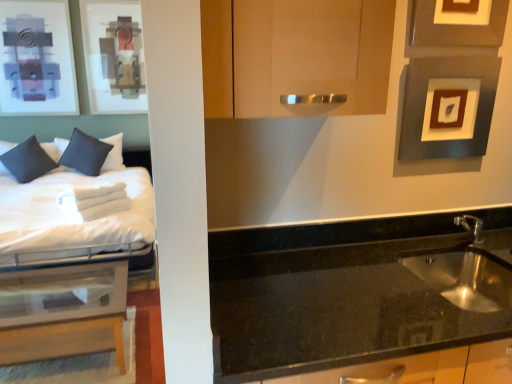
Question: Considering the relative positions of white soft bed at left and dark blue fabric pillow at left, which appears as the first pillow when viewed from the left, in the image provided, is white soft bed at left to the right of dark blue fabric pillow at left, which appears as the first pillow when viewed from the left, from the viewer's perspective?

Choices:
 (A) yes
 (B) no

Answer: (A)

Question: Can you confirm if white soft bed at left is smaller than dark blue fabric pillow at left, which appears as the first pillow when viewed from the left?

Choices:
 (A) no
 (B) yes

Answer: (A)

Question: Is white soft bed at left completely or partially outside of dark blue fabric pillow at left, which appears as the first pillow when viewed from the left?

Choices:
 (A) yes
 (B) no

Answer: (A)

Question: Is white soft bed at left oriented away from dark blue fabric pillow at left, which appears as the second pillow when viewed from the right?

Choices:
 (A) yes
 (B) no

Answer: (B)

Question: Is there a large distance between white soft bed at left and dark blue fabric pillow at left, which appears as the first pillow when viewed from the left?

Choices:
 (A) no
 (B) yes

Answer: (A)

Question: Visually, is translucent glass table at left positioned to the left or to the right of matte gray picture frame at upper right, the first picture frame in the bottom-to-top sequence?

Choices:
 (A) right
 (B) left

Answer: (B)

Question: In terms of height, does translucent glass table at left look taller or shorter compared to matte gray picture frame at upper right, the first picture frame in the bottom-to-top sequence?

Choices:
 (A) tall
 (B) short

Answer: (A)

Question: From the image's perspective, is translucent glass table at left positioned above or below matte gray picture frame at upper right, placed as the second picture frame when sorted from top to bottom?

Choices:
 (A) above
 (B) below

Answer: (B)

Question: Based on their sizes in the image, would you say translucent glass table at left is bigger or smaller than matte gray picture frame at upper right, placed as the second picture frame when sorted from top to bottom?

Choices:
 (A) small
 (B) big

Answer: (B)

Question: Is matte gray picture frame at upper right, placed as the second picture frame when sorted from top to bottom, spatially inside black granite sink at lower right, or outside of it?

Choices:
 (A) outside
 (B) inside

Answer: (A)

Question: In terms of width, does matte gray picture frame at upper right, the first picture frame in the bottom-to-top sequence, look wider or thinner when compared to black granite sink at lower right?

Choices:
 (A) wide
 (B) thin

Answer: (B)

Question: Considering the positions of matte gray picture frame at upper right, the first picture frame in the bottom-to-top sequence, and black granite sink at lower right in the image, is matte gray picture frame at upper right, the first picture frame in the bottom-to-top sequence, bigger or smaller than black granite sink at lower right?

Choices:
 (A) big
 (B) small

Answer: (B)

Question: Is matte gray picture frame at upper right, the first picture frame in the bottom-to-top sequence, in front of or behind black granite sink at lower right in the image?

Choices:
 (A) behind
 (B) front

Answer: (A)

Question: Considering the positions of black granite sink at lower right and matte gray picture frame at upper right, the first picture frame in the bottom-to-top sequence, in the image, is black granite sink at lower right bigger or smaller than matte gray picture frame at upper right, the first picture frame in the bottom-to-top sequence,?

Choices:
 (A) big
 (B) small

Answer: (A)

Question: Visually, is black granite sink at lower right positioned to the left or to the right of matte gray picture frame at upper right, placed as the second picture frame when sorted from top to bottom?

Choices:
 (A) right
 (B) left

Answer: (B)